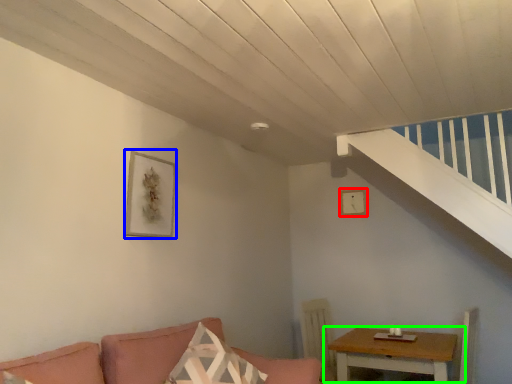
Question: Estimate the real-world distances between objects in this image. Which object is closer to picture frame (highlighted by a red box), picture frame (highlighted by a blue box) or table (highlighted by a green box)?

Choices:
 (A) picture frame
 (B) table

Answer: (B)